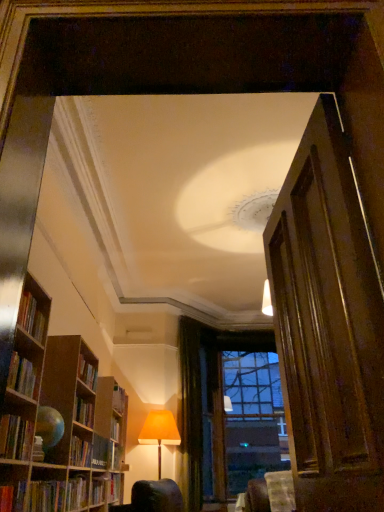
Question: Are orange fabric lampshade at lower center and hardcover book at lower left, arranged as the fourth book when viewed from the front, far apart?

Choices:
 (A) yes
 (B) no

Answer: (A)

Question: Can you confirm if orange fabric lampshade at lower center is thinner than hardcover book at lower left, the 4th book from the top?

Choices:
 (A) no
 (B) yes

Answer: (A)

Question: Can you confirm if orange fabric lampshade at lower center is wider than hardcover book at lower left, which is the 2th book from bottom to top?

Choices:
 (A) no
 (B) yes

Answer: (B)

Question: From the image's perspective, is orange fabric lampshade at lower center under hardcover book at lower left, which is the 2th book from bottom to top?

Choices:
 (A) no
 (B) yes

Answer: (B)

Question: From a real-world perspective, is orange fabric lampshade at lower center positioned under hardcover book at lower left, the 4th book from the top, based on gravity?

Choices:
 (A) yes
 (B) no

Answer: (B)

Question: From a real-world perspective, relative to hardcover book at left, marked as the fifth book in a back-to-front arrangement, is clear glass window at center vertically above or below?

Choices:
 (A) below
 (B) above

Answer: (B)

Question: Is clear glass window at center bigger or smaller than hardcover book at left, the third book positioned from the top?

Choices:
 (A) small
 (B) big

Answer: (B)

Question: Choose the correct answer: Is clear glass window at center inside hardcover book at left, marked as the fifth book in a back-to-front arrangement, or outside it?

Choices:
 (A) outside
 (B) inside

Answer: (A)

Question: Is clear glass window at center taller or shorter than hardcover book at left, the third book positioned from the top?

Choices:
 (A) short
 (B) tall

Answer: (B)

Question: From the image's perspective, is green velvet curtain at center above or below hardcover book at lower left, which is the 5th book from front to back?

Choices:
 (A) below
 (B) above

Answer: (B)

Question: Would you say green velvet curtain at center is inside or outside hardcover book at lower left, which is the 5th book from front to back?

Choices:
 (A) inside
 (B) outside

Answer: (B)

Question: From a real-world perspective, is green velvet curtain at center positioned above or below hardcover book at lower left, the fifth book when ordered from top to bottom?

Choices:
 (A) above
 (B) below

Answer: (A)

Question: Is point (198, 462) closer or farther from the camera than point (104, 486)?

Choices:
 (A) closer
 (B) farther

Answer: (B)

Question: Considering the positions of hardcover book at lower left, which is the 2th book from bottom to top, and hardcover book at left, the 1th book in the front-to-back sequence, in the image, is hardcover book at lower left, which is the 2th book from bottom to top, taller or shorter than hardcover book at left, the 1th book in the front-to-back sequence,?

Choices:
 (A) short
 (B) tall

Answer: (B)

Question: Considering the positions of hardcover book at lower left, which is the 2th book from bottom to top, and hardcover book at left, the 1th book in the front-to-back sequence, in the image, is hardcover book at lower left, which is the 2th book from bottom to top, bigger or smaller than hardcover book at left, the 1th book in the front-to-back sequence,?

Choices:
 (A) small
 (B) big

Answer: (B)